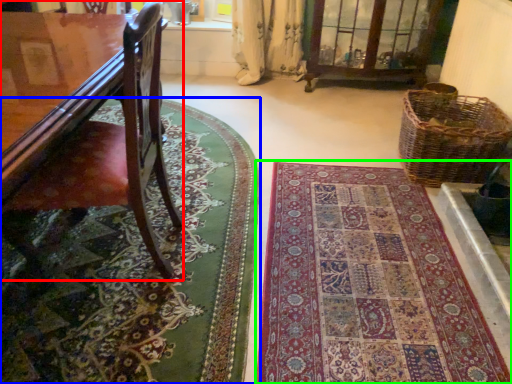
Question: Which object is positioned closest to furniture (highlighted by a red box)? Select from mat (highlighted by a blue box) and mat (highlighted by a green box).

Choices:
 (A) mat
 (B) mat

Answer: (A)